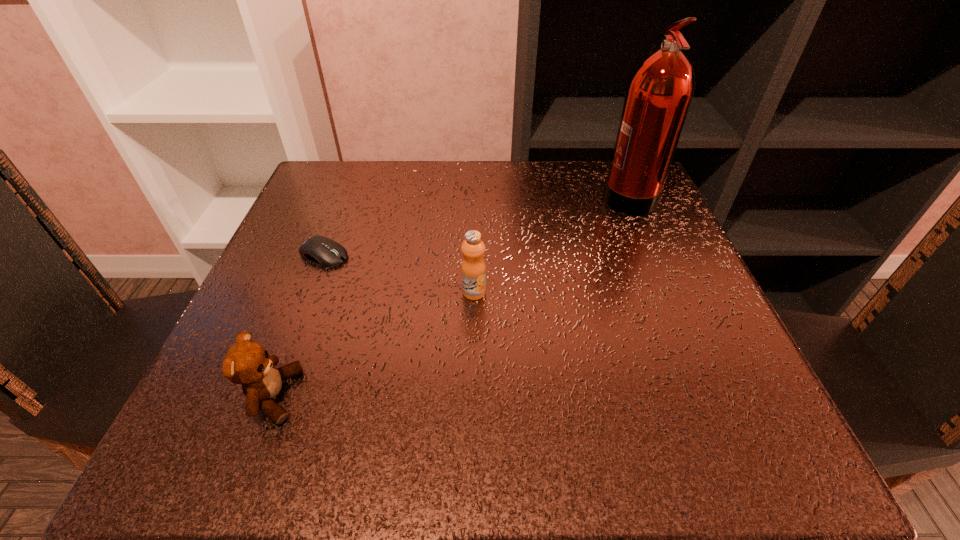
This screenshot has width=960, height=540. In order to click on vacant space that satisfies the following two spatial constraints: 1. on the front-facing side of the farthest object; 2. on the front label of the third farthest object in this screenshot , I will do `click(669, 292)`.

This screenshot has width=960, height=540. In order to click on vacant space that satisfies the following two spatial constraints: 1. on the front-facing side of the rightmost object; 2. on the front label of the second nearest object in this screenshot , I will do `click(669, 292)`.

The height and width of the screenshot is (540, 960). I want to click on vacant point that satisfies the following two spatial constraints: 1. on the front-facing side of the rightmost object; 2. on the front label of the third object from left to right, so click(x=669, y=292).

Where is `free space that satisfies the following two spatial constraints: 1. on the front label of the third farthest object; 2. on the front-facing side of the nearest object`? free space that satisfies the following two spatial constraints: 1. on the front label of the third farthest object; 2. on the front-facing side of the nearest object is located at coordinates (472, 396).